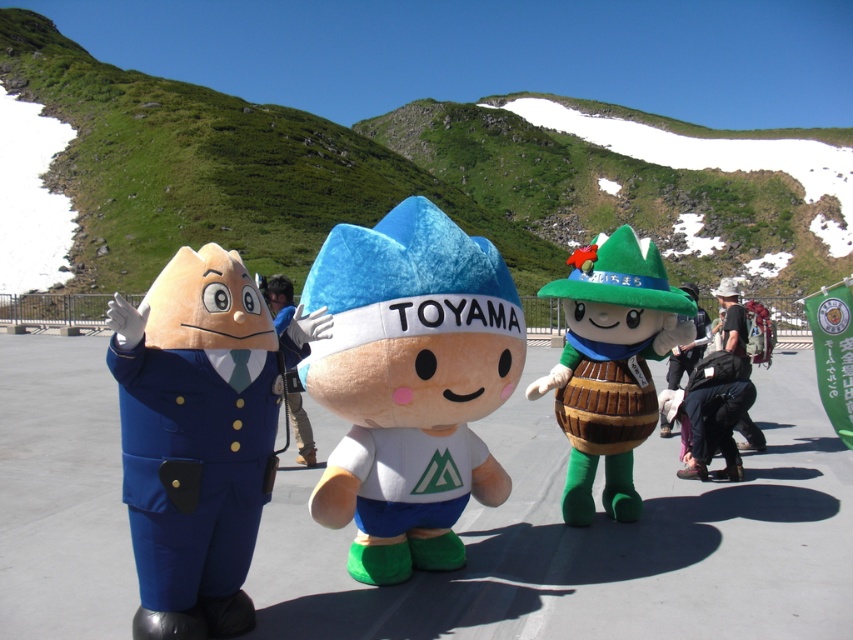
You are a photographer setting up a tripod to capture the scene with both the matte blue uniform at left and the blue fabric toy at center. Based on their positions, which object should you ensure is in focus first to avoid blurring due to depth of field limitations?

The matte blue uniform at left is located above the blue fabric toy at center, so you should focus on the matte blue uniform at left first since it is closer to the camera.

You are standing at the position of the first mascot on the left. You want to walk to the second mascot in the center. Which direction should you move relative to the point at coordinates point (581, 516) and point (294, 433)?

Since point (581, 516) is in front of point (294, 433), you should move forward towards the direction of point (581, 516) to reach the second mascot in the center.

You are a photographer trying to capture a photo of the matte blue uniform at left and the green felt hat at right. Based on their positions, which object should you frame first in your camera viewfinder to ensure both are in the shot?

Since the matte blue uniform at left is to the left of green felt hat at right, you should frame the matte blue uniform at left first as it is positioned further to the left, allowing you to adjust the viewfinder to include both objects from left to right.